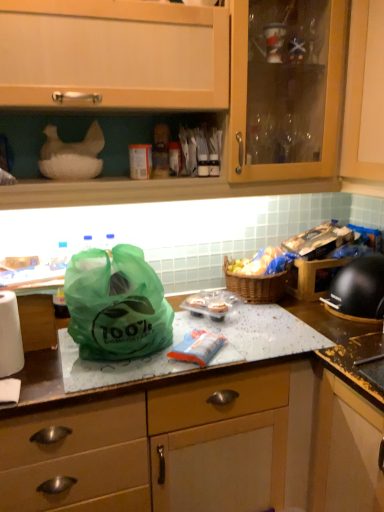
Where is `vacant region in front of woven brown picnic basket at center`? vacant region in front of woven brown picnic basket at center is located at coordinates (280, 318).